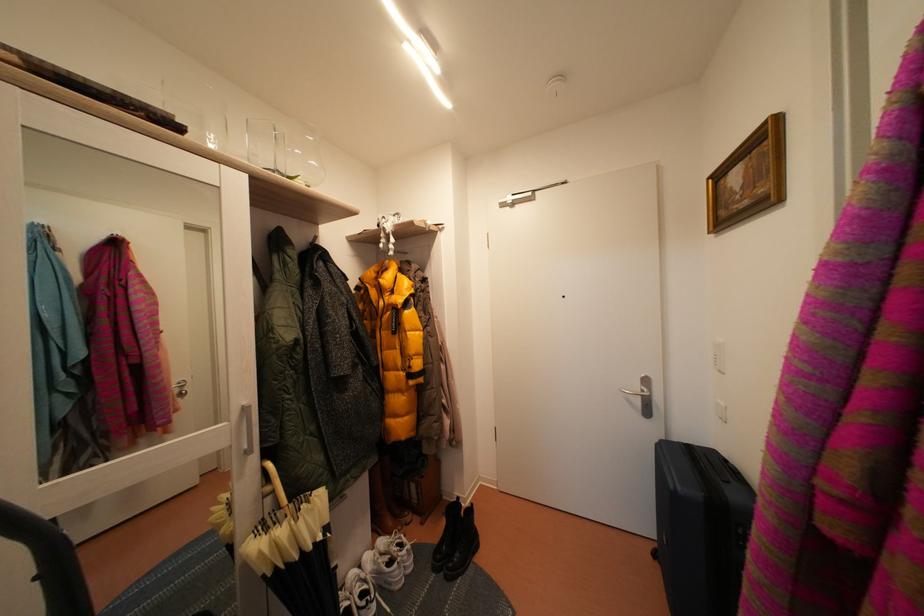
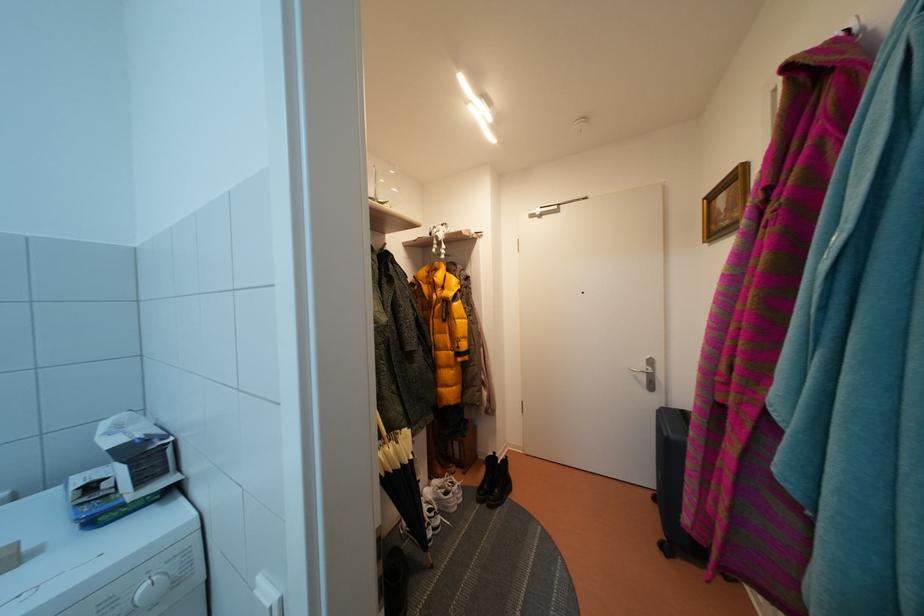
Where in the second image is the point corresponding to pixel 384 578 from the first image?

(444, 506)